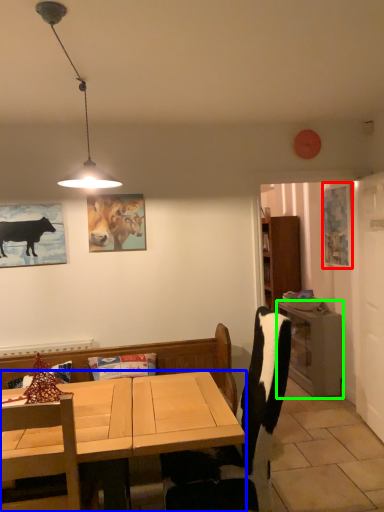
Question: Estimate the real-world distances between objects in this image. Which object is closer to picture frame (highlighted by a red box), desk (highlighted by a blue box) or table (highlighted by a green box)?

Choices:
 (A) desk
 (B) table

Answer: (B)